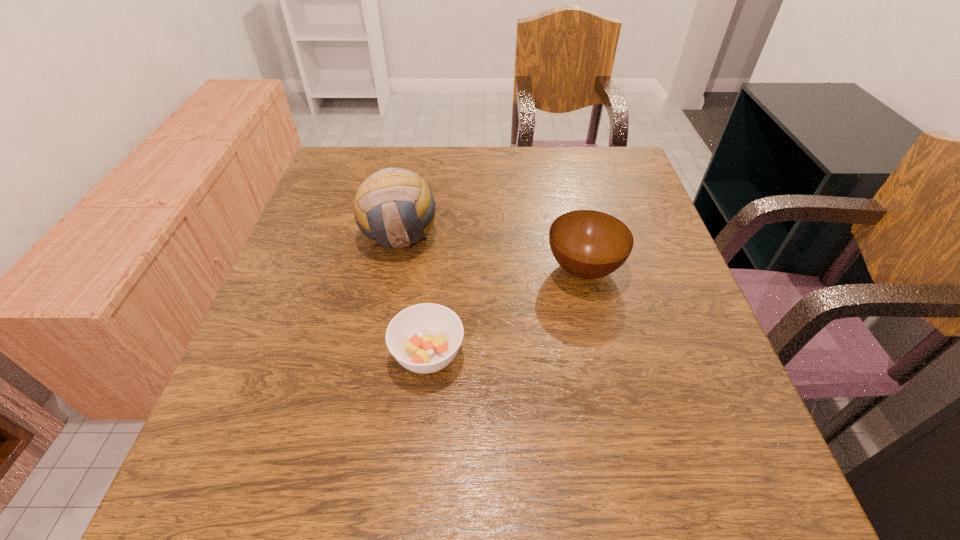
The width and height of the screenshot is (960, 540). In the image, there is a desktop. What are the coordinates of `vacant space at the far edge` in the screenshot? It's located at (520, 166).

Identify the location of free location at the near edge of the desktop. Image resolution: width=960 pixels, height=540 pixels. (402, 482).

You are a GUI agent. You are given a task and a screenshot of the screen. Output one action in this format:
    pyautogui.click(x=<x>, y=<y>)
    Task: Click on the free space at the left edge
    Image resolution: width=960 pixels, height=540 pixels.
    Given the screenshot: What is the action you would take?
    pyautogui.click(x=308, y=381)

Where is `free space at the right edge of the desktop`? free space at the right edge of the desktop is located at coordinates (645, 280).

You are a GUI agent. You are given a task and a screenshot of the screen. Output one action in this format:
    pyautogui.click(x=<x>, y=<y>)
    Task: Click on the free spot at the near right corner of the desktop
    Image resolution: width=960 pixels, height=540 pixels.
    Given the screenshot: What is the action you would take?
    pyautogui.click(x=757, y=486)

You are a GUI agent. You are given a task and a screenshot of the screen. Output one action in this format:
    pyautogui.click(x=<x>, y=<y>)
    Task: Click on the unoccupied area between the bowl and the shortest object
    
    Given the screenshot: What is the action you would take?
    pyautogui.click(x=506, y=312)

You are a GUI agent. You are given a task and a screenshot of the screen. Output one action in this format:
    pyautogui.click(x=<x>, y=<y>)
    Task: Click on the free space between the volleyball and the nearest object
    
    Given the screenshot: What is the action you would take?
    pyautogui.click(x=414, y=295)

You are a GUI agent. You are given a task and a screenshot of the screen. Output one action in this format:
    pyautogui.click(x=<x>, y=<y>)
    Task: Click on the free space between the nearest object and the volleyball
    
    Given the screenshot: What is the action you would take?
    point(414,295)

I want to click on unoccupied position between the rightmost object and the soup bowl, so click(506, 312).

Where is `free area in between the nearest object and the volleyball`? Image resolution: width=960 pixels, height=540 pixels. free area in between the nearest object and the volleyball is located at coordinates (414, 295).